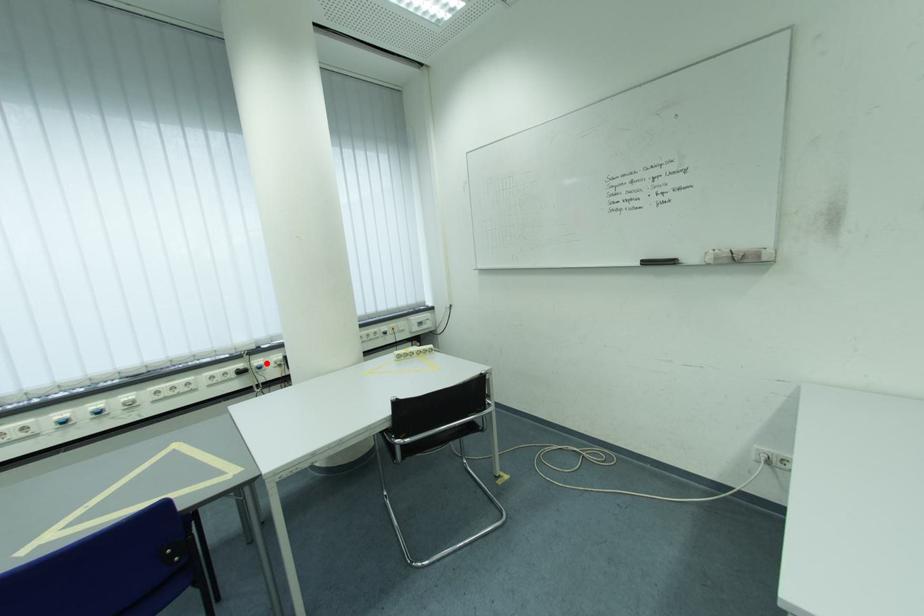
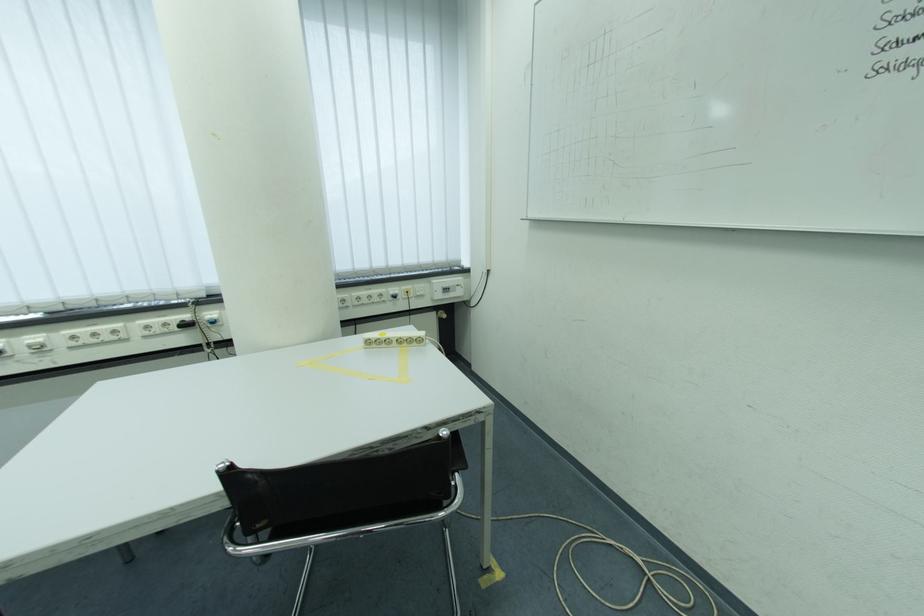
Locate, in the second image, the point that corresponds to the highlighted location in the first image.

(217, 315)